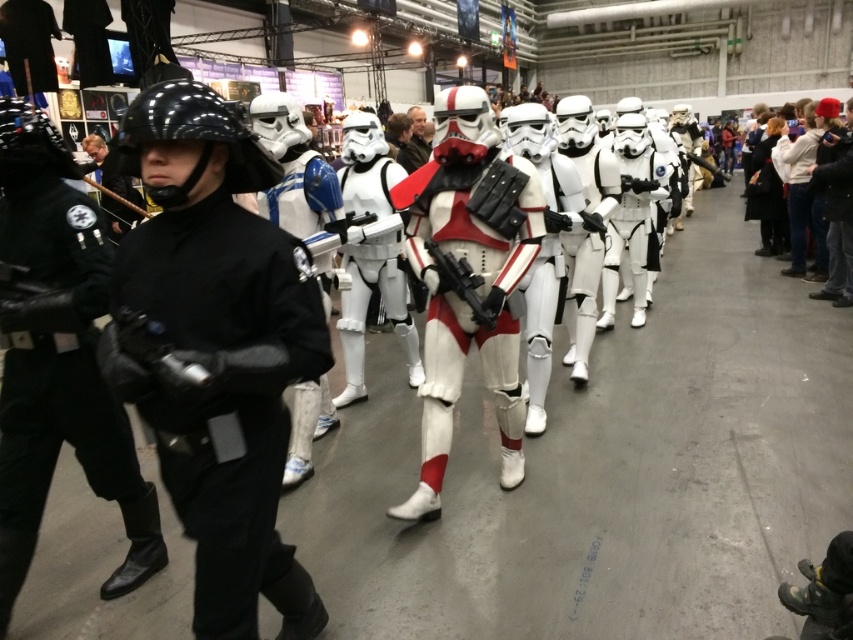
Can you confirm if black matte uniform at center is taller than black matte helmet at left?

No, black matte uniform at center is not taller than black matte helmet at left.

Between black matte uniform at center and black matte helmet at left, which one has more height?

black matte helmet at left is taller.

Which is in front, point (289, 355) or point (67, 312)?

Positioned in front is point (289, 355).

In order to click on black matte uniform at center in this screenshot , I will do `click(221, 394)`.

The image size is (853, 640). Find the location of `black matte uniform at center`. black matte uniform at center is located at coordinates (221, 394).

Can you confirm if black matte uniform at center is wider than white matte/soft plastic armor at center?

No, black matte uniform at center is not wider than white matte/soft plastic armor at center.

Is point (177, 458) farther from viewer compared to point (450, 324)?

That is False.

This screenshot has width=853, height=640. Identify the location of black matte uniform at center. (221, 394).

Which is above, black matte helmet at left or white matte/soft plastic armor at center?

white matte/soft plastic armor at center is above.

Is black matte helmet at left smaller than white matte/soft plastic armor at center?

Yes, black matte helmet at left is smaller than white matte/soft plastic armor at center.

Locate an element on the screen. The width and height of the screenshot is (853, 640). black matte helmet at left is located at coordinates (57, 358).